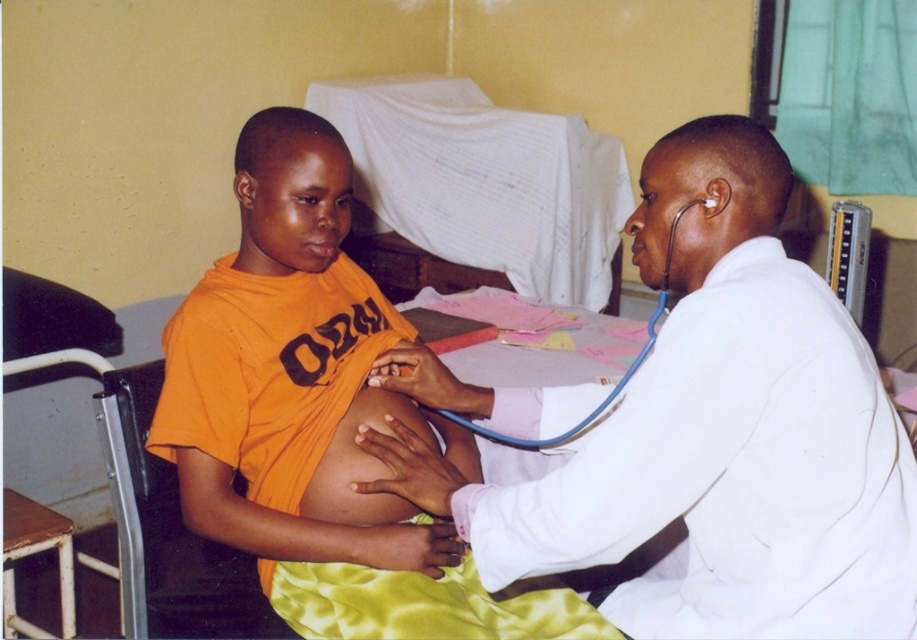
Question: Among these points, which one is nearest to the camera?

Choices:
 (A) (434, 636)
 (B) (768, 404)
 (C) (650, 339)

Answer: (B)

Question: Among these points, which one is nearest to the camera?

Choices:
 (A) (666, 259)
 (B) (241, 320)
 (C) (730, 236)

Answer: (C)

Question: Where is orange cotton shirt at center located in relation to blue rubber stethoscope at upper right in the image?

Choices:
 (A) left
 (B) right

Answer: (A)

Question: Considering the real-world distances, which object is farthest from the blue rubber stethoscope at upper right?

Choices:
 (A) orange cotton shirt at center
 (B) white smooth coat at upper right

Answer: (A)

Question: Does white smooth coat at upper right appear under orange cotton shirt at center?

Choices:
 (A) no
 (B) yes

Answer: (B)

Question: Can you confirm if white smooth coat at upper right is positioned to the right of blue rubber stethoscope at upper right?

Choices:
 (A) yes
 (B) no

Answer: (A)